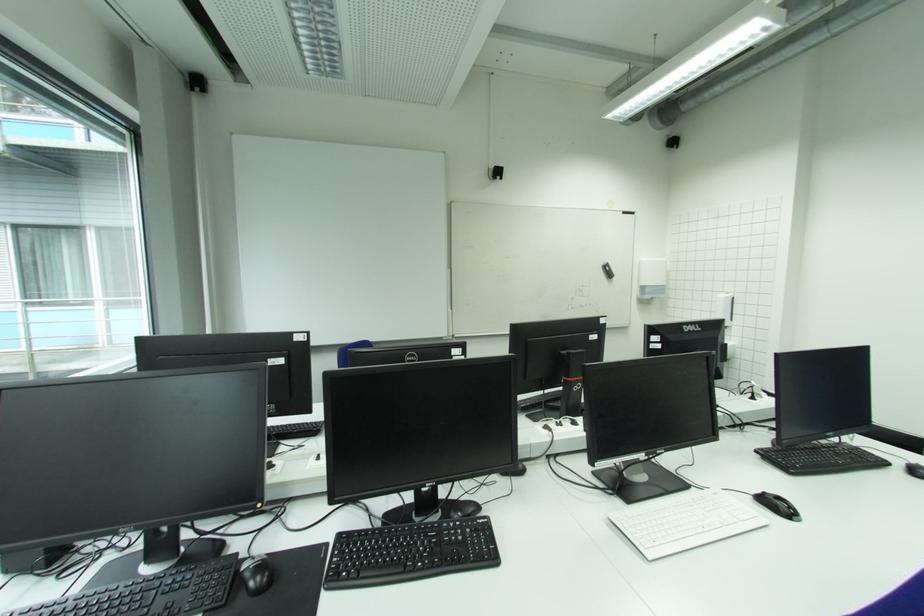
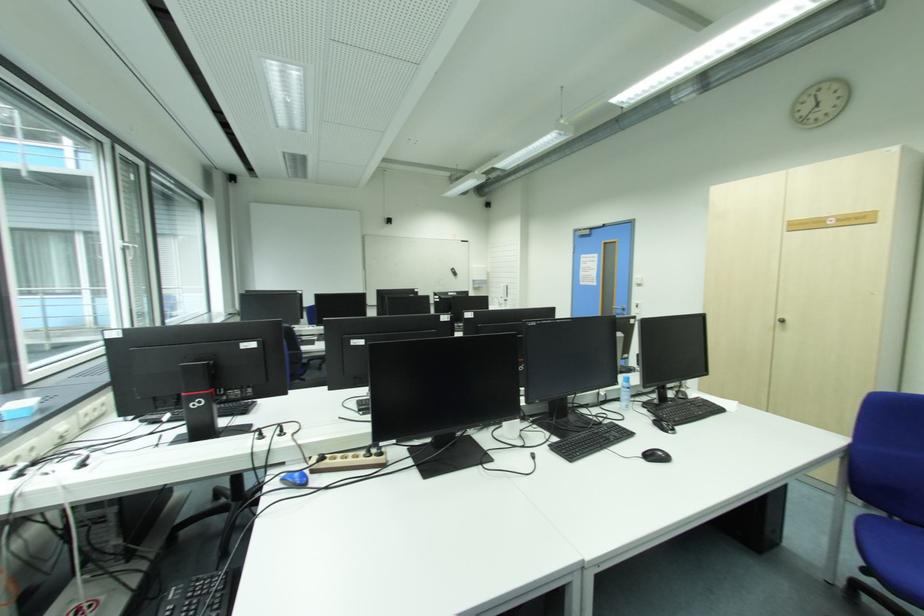
Question: In a continuous first-person perspective shot, in which direction is the camera moving?

Choices:
 (A) Left
 (B) Right
 (C) Forward
 (D) Backward

Answer: (D)